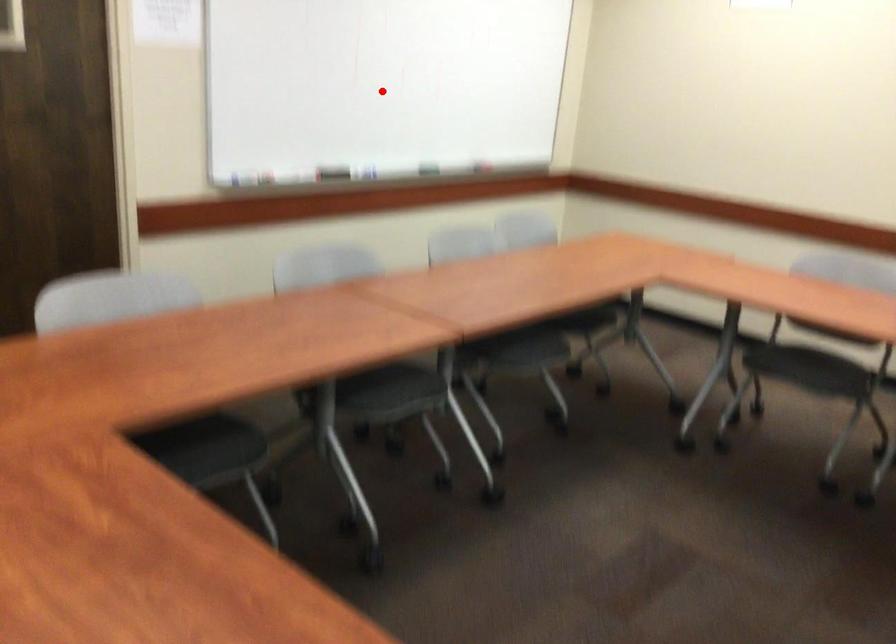
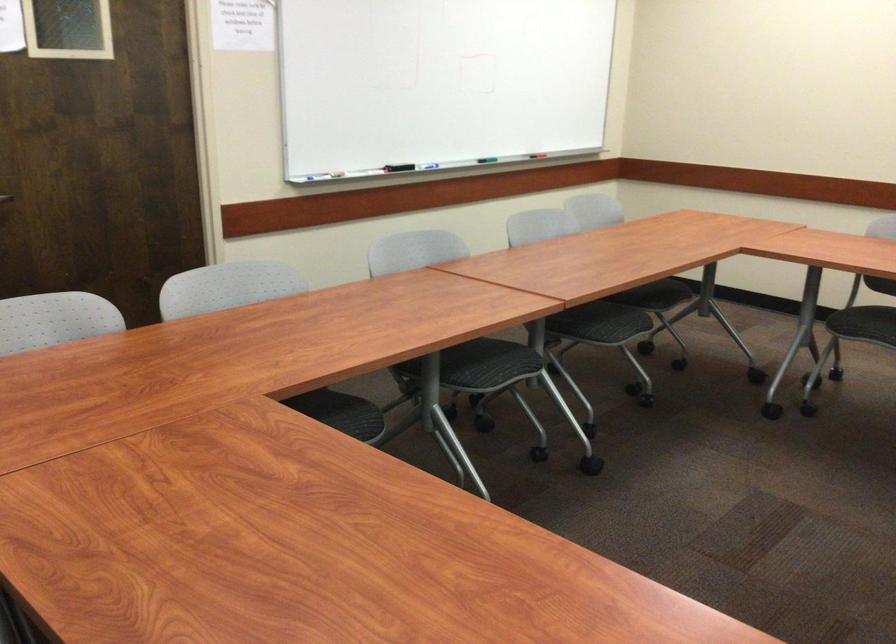
In the second image, find the point that corresponds to the highlighted location in the first image.

(438, 82)